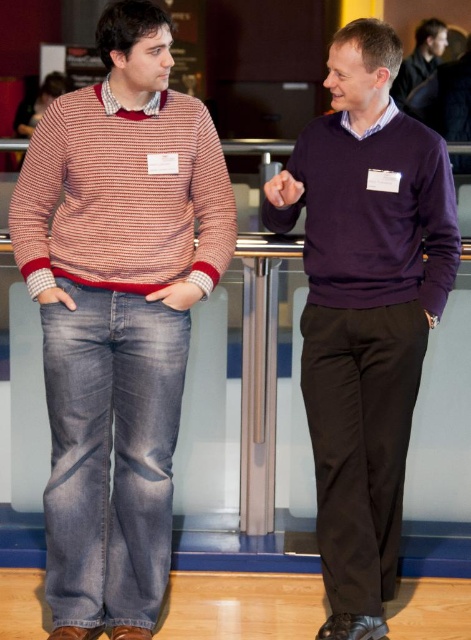
Which is in front, point (388, 461) or point (416, 40)?

Point (388, 461)

This screenshot has width=471, height=640. What do you see at coordinates (365, 308) in the screenshot?
I see `purple matte sweater at center` at bounding box center [365, 308].

Between point (350, 164) and point (443, 35), which one is positioned in front?

Point (350, 164) is in front.

The image size is (471, 640). I want to click on purple matte sweater at center, so click(x=365, y=308).

Who is positioned more to the right, matte red and white sweater at left or matte purple sweater at upper right?

From the viewer's perspective, matte purple sweater at upper right appears more on the right side.

Is matte red and white sweater at left positioned before matte purple sweater at upper right?

Yes, matte red and white sweater at left is in front of matte purple sweater at upper right.

Does point (128, 61) come behind point (399, 72)?

No, it is not.

Find the location of a particular element. matte red and white sweater at left is located at coordinates (x=118, y=312).

Does matte red and white sweater at left have a greater height compared to purple matte sweater at center?

Yes.

Is the position of matte red and white sweater at left more distant than that of purple matte sweater at center?

No, it is not.

Is point (120, 317) positioned after point (400, 432)?

No, (120, 317) is in front of (400, 432).

At what (x,y) coordinates should I click in order to perform the action: click on matte red and white sweater at left. Please return your answer as a coordinate pair (x, y). This screenshot has height=640, width=471. Looking at the image, I should click on (118, 312).